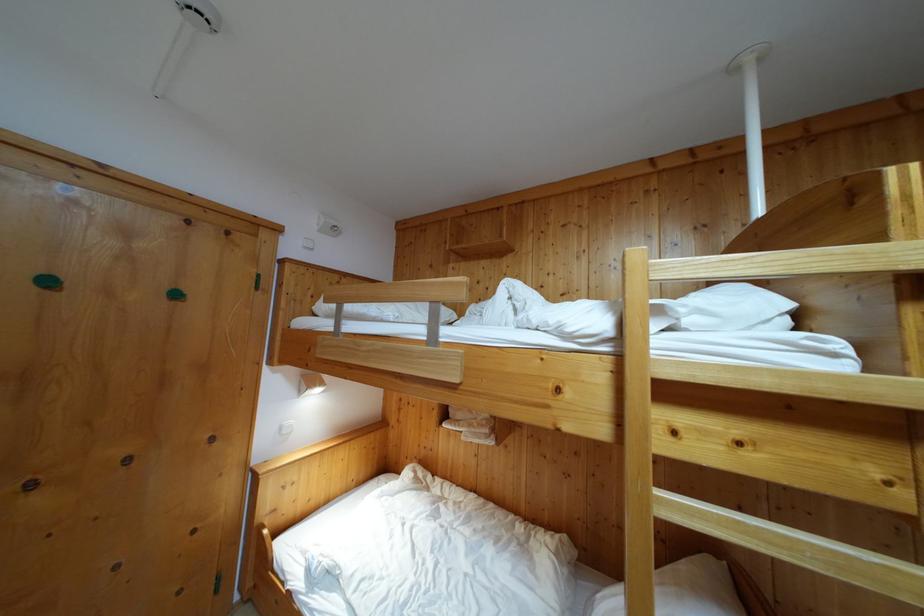
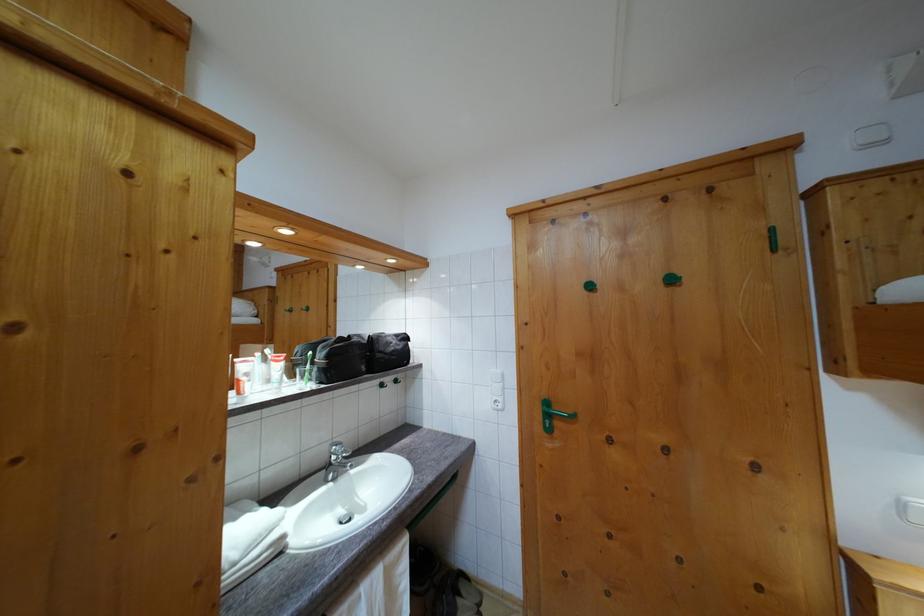
The point at (53, 290) is marked in the first image. Where is the corresponding point in the second image?

(593, 294)